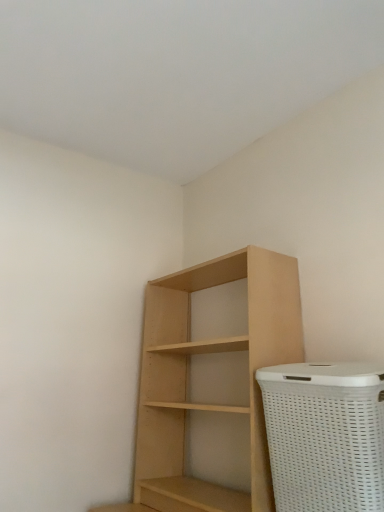
Question: Choose the correct answer: Is natural wood shelf at center inside white woven basket at lower right or outside it?

Choices:
 (A) outside
 (B) inside

Answer: (A)

Question: Is natural wood shelf at center to the left or to the right of white woven basket at lower right in the image?

Choices:
 (A) left
 (B) right

Answer: (A)

Question: From the image's perspective, relative to white woven basket at lower right, is natural wood shelf at center above or below?

Choices:
 (A) above
 (B) below

Answer: (A)

Question: Looking at their shapes, would you say white woven basket at lower right is wider or thinner than natural wood shelf at center?

Choices:
 (A) thin
 (B) wide

Answer: (A)

Question: Considering their positions, is white woven basket at lower right located in front of or behind natural wood shelf at center?

Choices:
 (A) behind
 (B) front

Answer: (B)

Question: Is white woven basket at lower right inside or outside of natural wood shelf at center?

Choices:
 (A) outside
 (B) inside

Answer: (A)

Question: From a real-world perspective, relative to natural wood shelf at center, is white woven basket at lower right vertically above or below?

Choices:
 (A) below
 (B) above

Answer: (A)